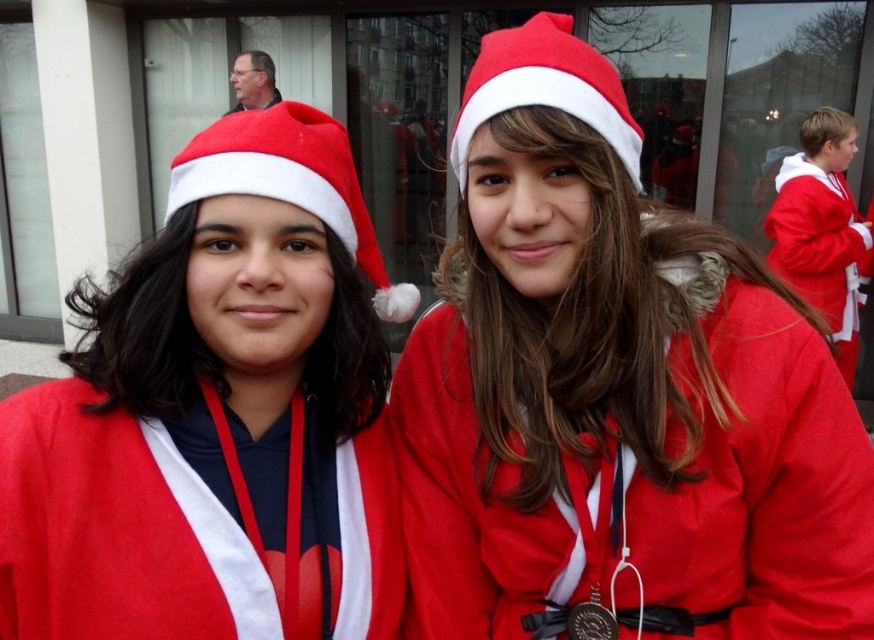
You are a photographer standing 3 feet away from the two subjects. You want to capture a closeup shot of the matte red santa hat at center and the metallic gold medal at center in the same frame. Given the distance between them, will you need to adjust your camera angle to ensure both are fully visible?

The distance between the matte red santa hat at center and the metallic gold medal at center is 22.15 inches. Since you are 3 feet away, which is approximately 36 inches, the distance between them is less than your distance from them. Therefore, you can capture both in the same frame without needing to adjust your camera angle significantly.

You are a photographer standing at a distance of 10 feet from the two individuals in the festive attire. You want to capture a closeup shot of both the matte red coat at center and the matte red santa hat at center in the same frame. Given that your camera has a maximum focus range of 10 feet, will you be able to focus on both objects simultaneously?

The matte red coat at center is 12.57 inches from the matte red santa hat at center. Since both objects are within the same focal plane and the distance from the photographer to the objects is 10 feet, which is within the camera maximum focus range of 10 feet, the camera can focus on both the matte red coat at center and the matte red santa hat at center simultaneously.